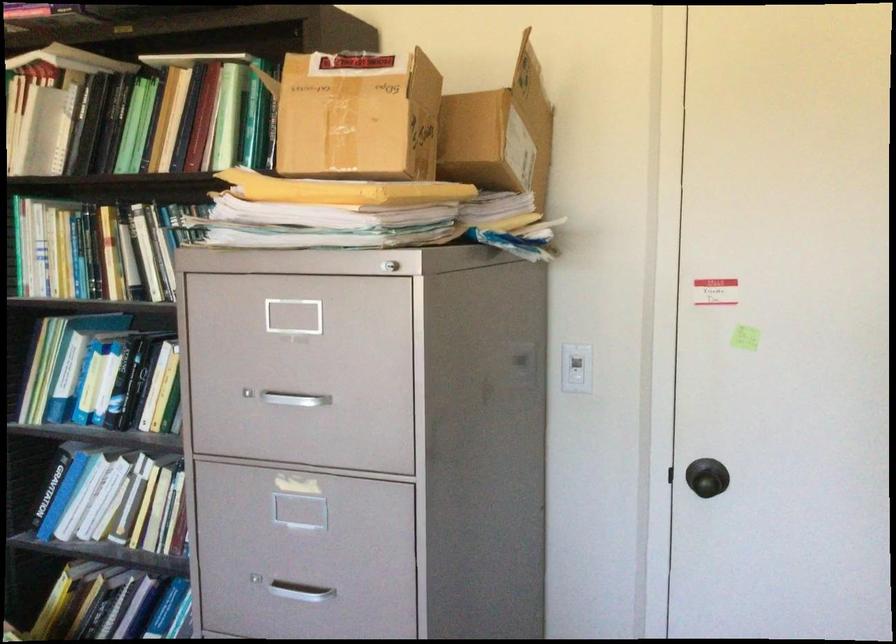
Find where to turn the round doorknob. Please return your answer as a coordinate pair (x, y).

(707, 482)